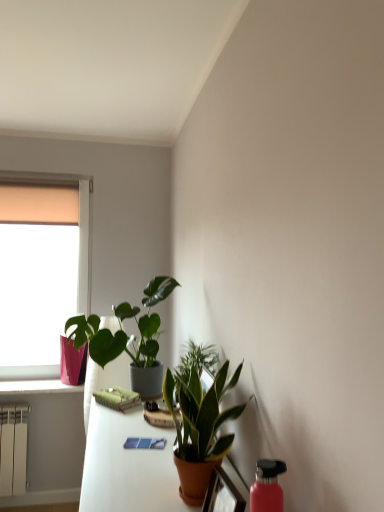
Where is `free space above matte pink vase at left (from a real-world perspective)`? This screenshot has width=384, height=512. free space above matte pink vase at left (from a real-world perspective) is located at coordinates [x=41, y=170].